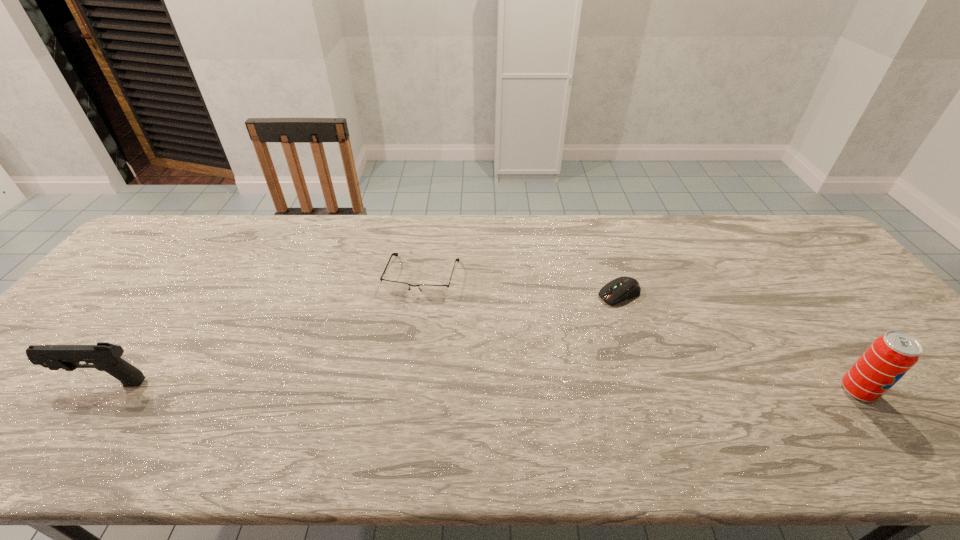
The height and width of the screenshot is (540, 960). I want to click on free space on the desktop that is between the leftmost object and the soda can and is positioned on the button of the second object from right to left, so (430, 386).

Find the location of `vacant space on the desktop that is between the pistol and the rightmost object and is positioned on the front-facing side of the spectacles`. vacant space on the desktop that is between the pistol and the rightmost object and is positioned on the front-facing side of the spectacles is located at coordinates (385, 386).